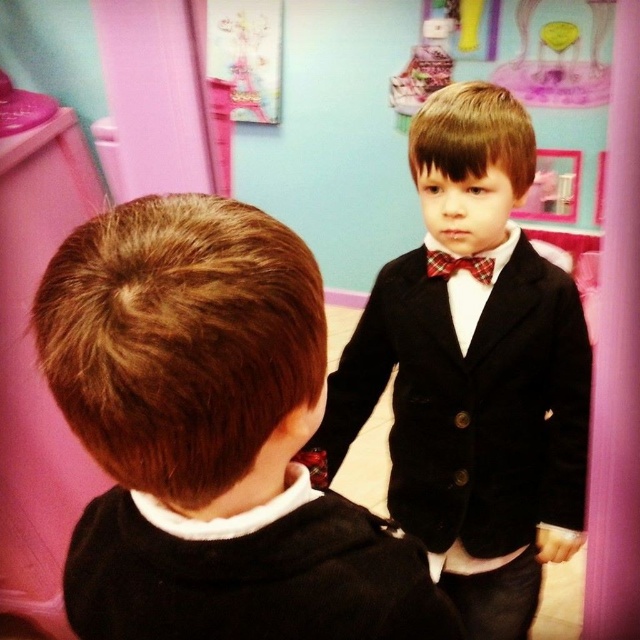
You are standing in the room and want to determine which of the two points, point (456, 365) or point (429, 262), is closer to you. Based on the scene description, which point is nearer?

Point (456, 365) is closer to the camera than point (429, 262), so it is nearer to you.

You are a tailor trying to decide whether to place a plaid fabric bow tie at center on top of a black velvet suit at center. Will the bow tie fit without hanging off the edges?

The black velvet suit at center might be wider than plaid fabric bow tie at center, so there is a possibility the plaid fabric bow tie at center will fit. However, since the width comparison is uncertain, it is recommended to check the exact measurements before placing the bow tie.